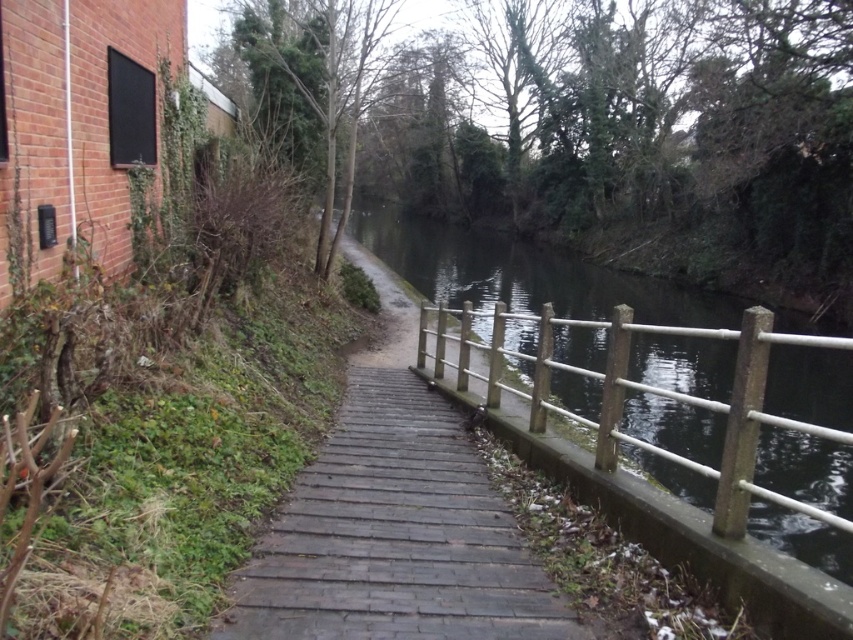
Question: Does wooden planks at center appear under wooden rail at center?

Choices:
 (A) yes
 (B) no

Answer: (A)

Question: Does wooden planks at center have a smaller size compared to wooden rail at center?

Choices:
 (A) no
 (B) yes

Answer: (A)

Question: Which object appears closest to the camera in this image?

Choices:
 (A) wooden rail at center
 (B) wooden planks at center

Answer: (B)

Question: Among these points, which one is nearest to the camera?

Choices:
 (A) tap(312, 604)
 (B) tap(752, 394)

Answer: (B)

Question: Which object appears closest to the camera in this image?

Choices:
 (A) wooden planks at center
 (B) wooden rail at center

Answer: (A)

Question: Can you confirm if wooden planks at center is positioned to the left of wooden rail at center?

Choices:
 (A) yes
 (B) no

Answer: (A)